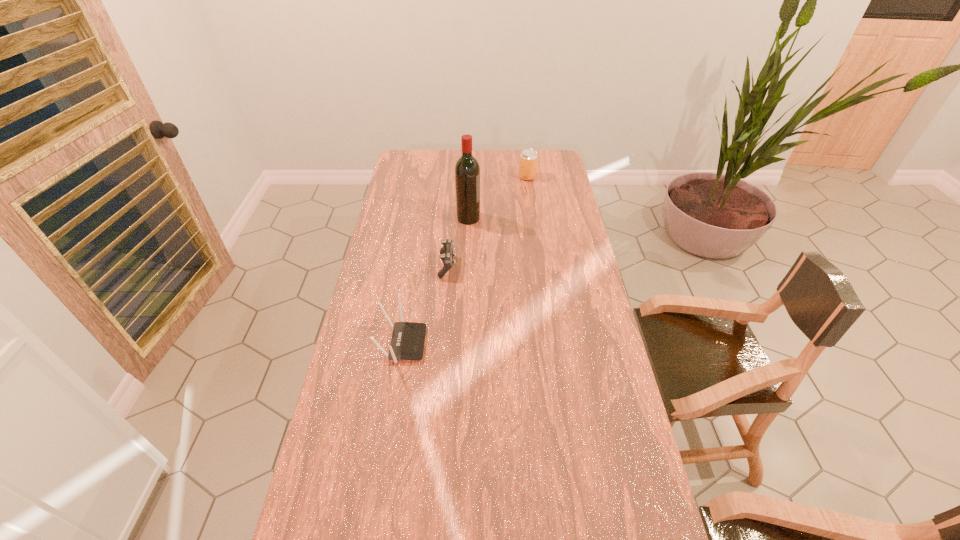
Where is `wine bottle`? Image resolution: width=960 pixels, height=540 pixels. wine bottle is located at coordinates (467, 170).

Where is `the tallest object`? the tallest object is located at coordinates (467, 170).

Find the location of a particular element. pop (soda) is located at coordinates (528, 158).

The image size is (960, 540). I want to click on the farthest object, so click(x=528, y=158).

Locate an element on the screen. the leftmost object is located at coordinates (408, 338).

Image resolution: width=960 pixels, height=540 pixels. Find the location of `router`. router is located at coordinates (408, 338).

You are a GUI agent. You are given a task and a screenshot of the screen. Output one action in this format:
    pyautogui.click(x=<x>, y=<y>)
    Task: Click on the shortest object
    The image size is (960, 540).
    Given the screenshot: What is the action you would take?
    pyautogui.click(x=446, y=252)

Locate an element on the screen. the third farthest object is located at coordinates (446, 252).

The image size is (960, 540). I want to click on vacant space located 0.080m on the label of the third nearest object, so click(499, 218).

Image resolution: width=960 pixels, height=540 pixels. Find the location of `vacant area situated on the left of the farthest object`. vacant area situated on the left of the farthest object is located at coordinates (492, 177).